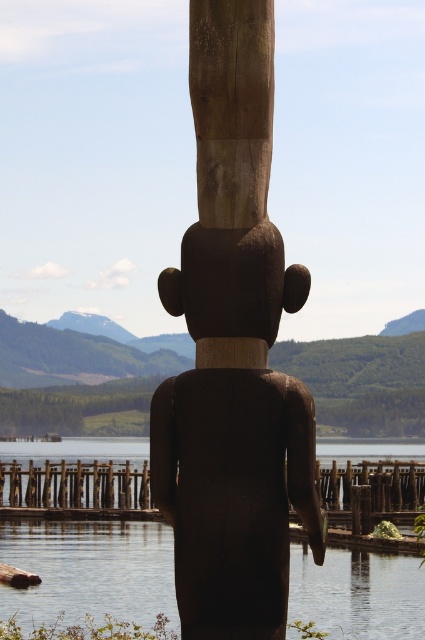
Which is below, transparent water at center or brown wooden dock at lower center?

transparent water at center is lower down.

Between transparent water at center and brown wooden dock at lower center, which one appears on the right side from the viewer's perspective?

transparent water at center

What do you see at coordinates (90, 570) in the screenshot? I see `transparent water at center` at bounding box center [90, 570].

Where is `transparent water at center`? transparent water at center is located at coordinates (90, 570).

The image size is (425, 640). Describe the element at coordinates (232, 353) in the screenshot. I see `brown polished wood totem pole at center` at that location.

Does point (223, 268) come in front of point (393, 589)?

That is True.

Between point (238, 490) and point (96, 618), which one is positioned in front?

Point (238, 490)

Find the location of a particular element. brown polished wood totem pole at center is located at coordinates (232, 353).

Which of these two, brown polished wood totem pole at center or brown wooden dock at lower center, stands taller?

Standing taller between the two is brown wooden dock at lower center.

Between brown polished wood totem pole at center and brown wooden dock at lower center, which one appears on the left side from the viewer's perspective?

From the viewer's perspective, brown polished wood totem pole at center appears more on the left side.

Where is `brown polished wood totem pole at center`? brown polished wood totem pole at center is located at coordinates (232, 353).

Where is `brown polished wood totem pole at center`? This screenshot has width=425, height=640. brown polished wood totem pole at center is located at coordinates (232, 353).